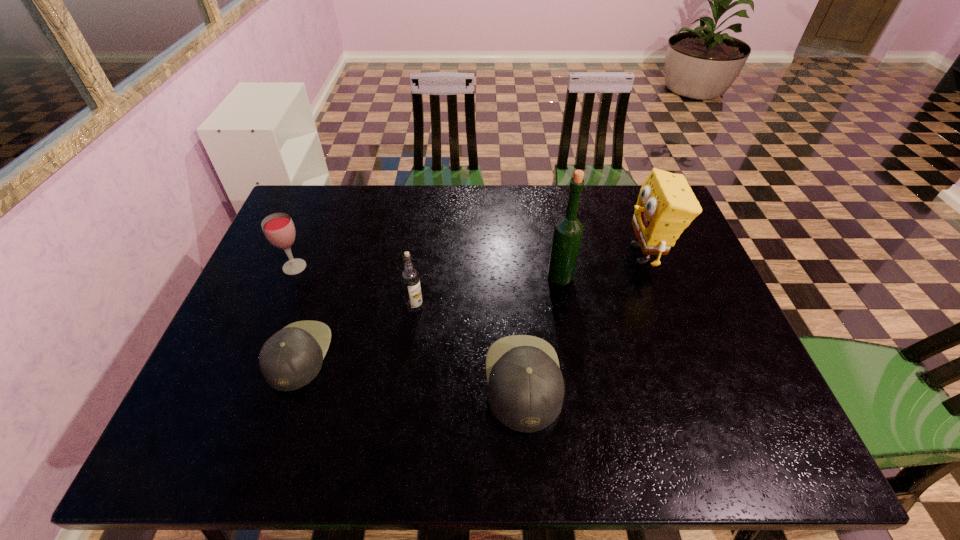
Where is `object identified as the fifth closest to the second object from right to left`? This screenshot has width=960, height=540. object identified as the fifth closest to the second object from right to left is located at coordinates (278, 228).

Identify the location of free location that satisfies the following two spatial constraints: 1. on the label of the third object from left to right; 2. on the brim of the shortest object. (409, 355).